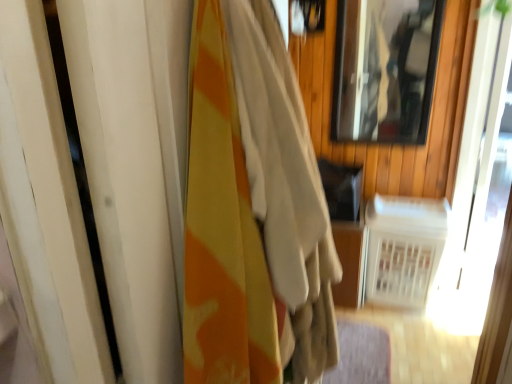
Question: From a real-world perspective, is white plastic radiator at lower right physically below clear glass mirror at upper right?

Choices:
 (A) no
 (B) yes

Answer: (B)

Question: Is there a large distance between white plastic radiator at lower right and clear glass mirror at upper right?

Choices:
 (A) yes
 (B) no

Answer: (B)

Question: Is white plastic radiator at lower right at the right side of clear glass mirror at upper right?

Choices:
 (A) no
 (B) yes

Answer: (B)

Question: Considering the relative sizes of white plastic radiator at lower right and clear glass mirror at upper right in the image provided, is white plastic radiator at lower right shorter than clear glass mirror at upper right?

Choices:
 (A) no
 (B) yes

Answer: (B)

Question: Is white plastic radiator at lower right wider than clear glass mirror at upper right?

Choices:
 (A) yes
 (B) no

Answer: (A)

Question: From a real-world perspective, is white plastic radiator at lower right on top of clear glass mirror at upper right?

Choices:
 (A) no
 (B) yes

Answer: (A)

Question: Considering the relative positions of white plastic radiator at lower right and camouflage fabric curtain at left in the image provided, is white plastic radiator at lower right to the right of camouflage fabric curtain at left from the viewer's perspective?

Choices:
 (A) yes
 (B) no

Answer: (A)

Question: Is white plastic radiator at lower right thinner than camouflage fabric curtain at left?

Choices:
 (A) yes
 (B) no

Answer: (B)

Question: From a real-world perspective, is white plastic radiator at lower right below camouflage fabric curtain at left?

Choices:
 (A) no
 (B) yes

Answer: (B)

Question: From the image's perspective, is white plastic radiator at lower right on camouflage fabric curtain at left?

Choices:
 (A) no
 (B) yes

Answer: (A)

Question: Is white plastic radiator at lower right further to camera compared to camouflage fabric curtain at left?

Choices:
 (A) no
 (B) yes

Answer: (B)

Question: Considering the relative sizes of white plastic radiator at lower right and camouflage fabric curtain at left in the image provided, is white plastic radiator at lower right smaller than camouflage fabric curtain at left?

Choices:
 (A) no
 (B) yes

Answer: (B)

Question: Considering the relative sizes of clear glass mirror at upper right and white plastic radiator at lower right in the image provided, is clear glass mirror at upper right bigger than white plastic radiator at lower right?

Choices:
 (A) no
 (B) yes

Answer: (A)